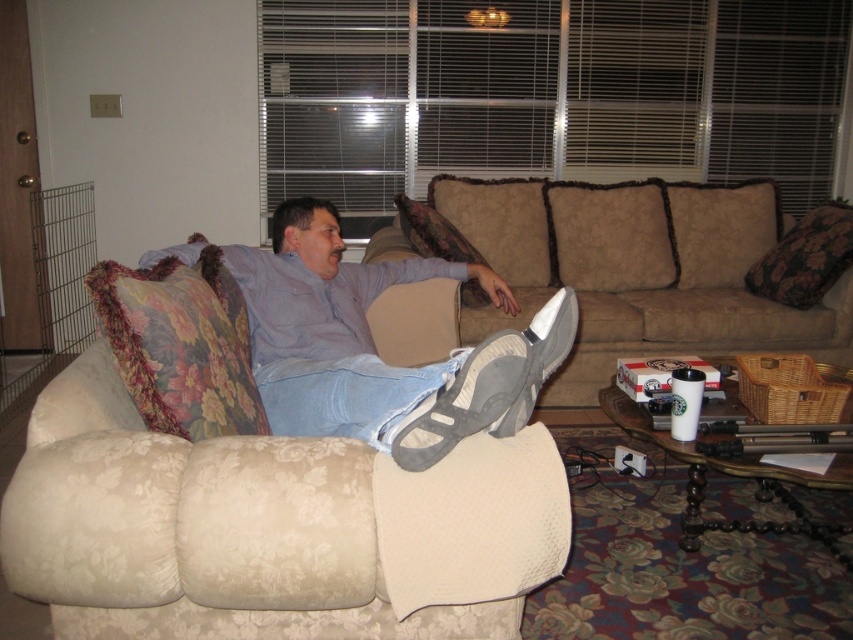
Question: Is floral fabric pillow at right smaller than floral fabric pillow at center?

Choices:
 (A) no
 (B) yes

Answer: (B)

Question: Which object is positioned farthest from the beige fabric couch at center?

Choices:
 (A) floral fabric pillow at right
 (B) floral fabric pillow at left

Answer: (B)

Question: Where is floral fabric pillow at left located in relation to floral fabric pillow at center in the image?

Choices:
 (A) left
 (B) right

Answer: (A)

Question: Which point is closer to the camera taking this photo?

Choices:
 (A) (280, 368)
 (B) (438, 237)
 (C) (757, 276)
 (D) (172, 264)

Answer: (D)

Question: Is beige fabric couch at center below floral fabric pillow at right?

Choices:
 (A) no
 (B) yes

Answer: (B)

Question: Which point is farther from the camera taking this photo?

Choices:
 (A) (405, 429)
 (B) (432, 220)
 (C) (514, 252)
 (D) (790, 273)

Answer: (C)